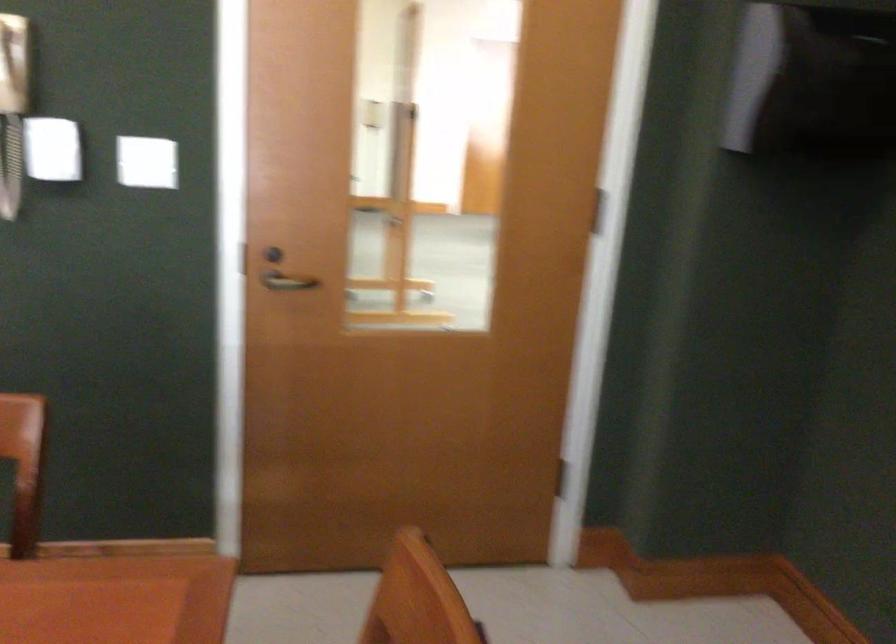
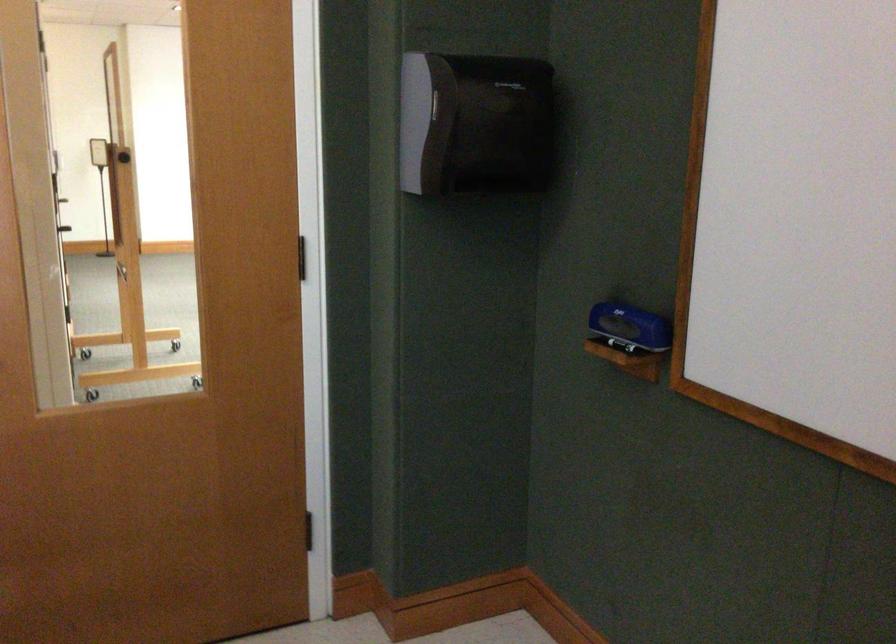
Find the pixel in the second image that matches point 819,75 in the first image.

(474, 122)